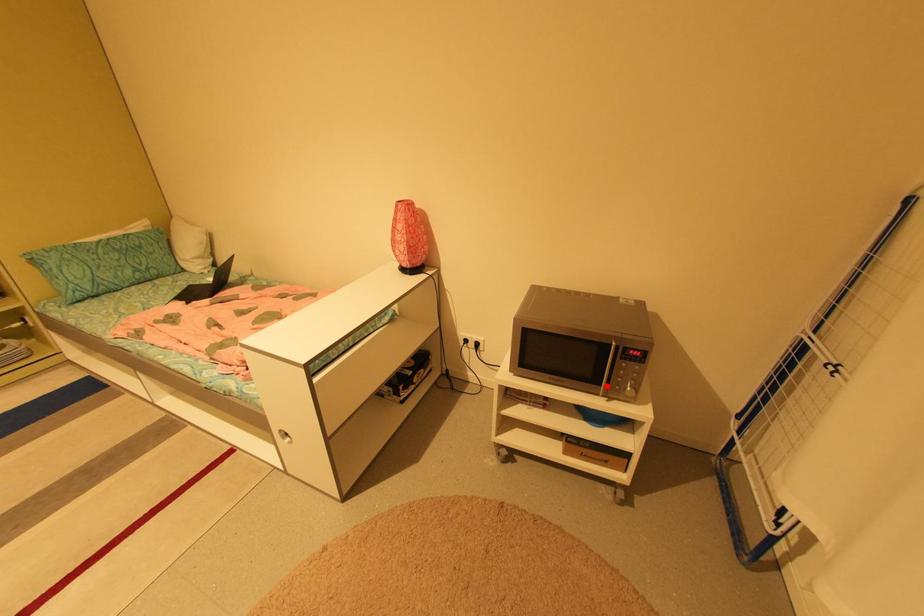
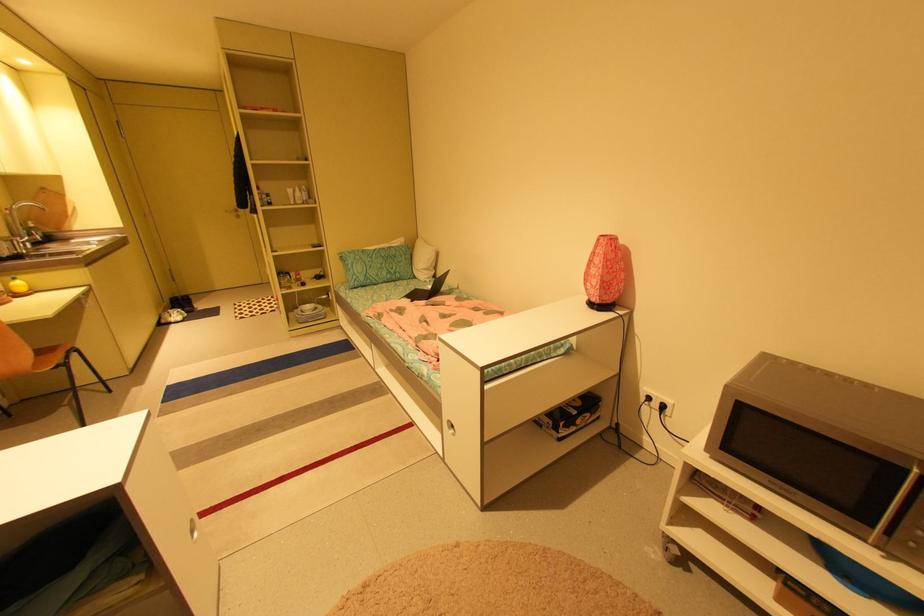
Where in the second image is the point corresponding to the highlighted location from the first image?

(879, 528)